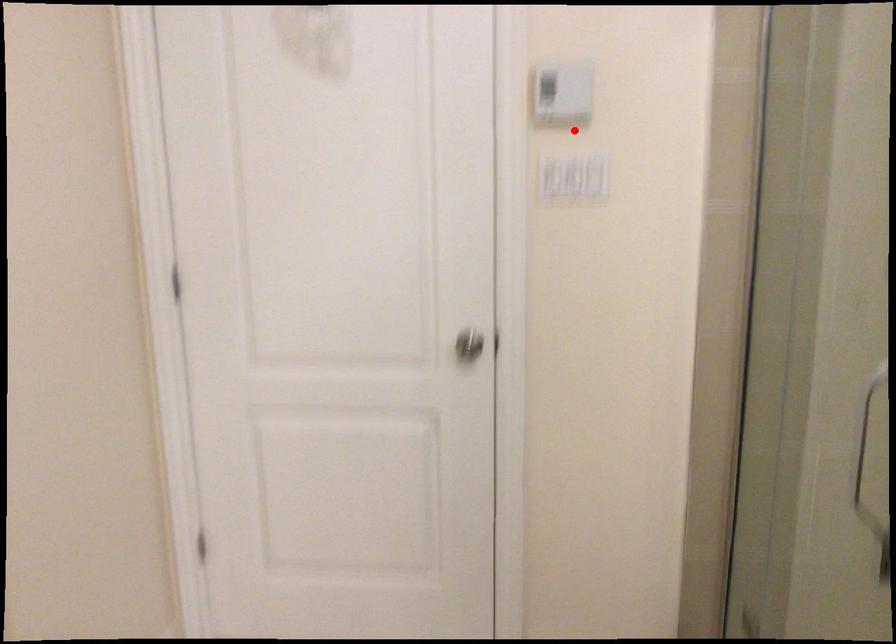
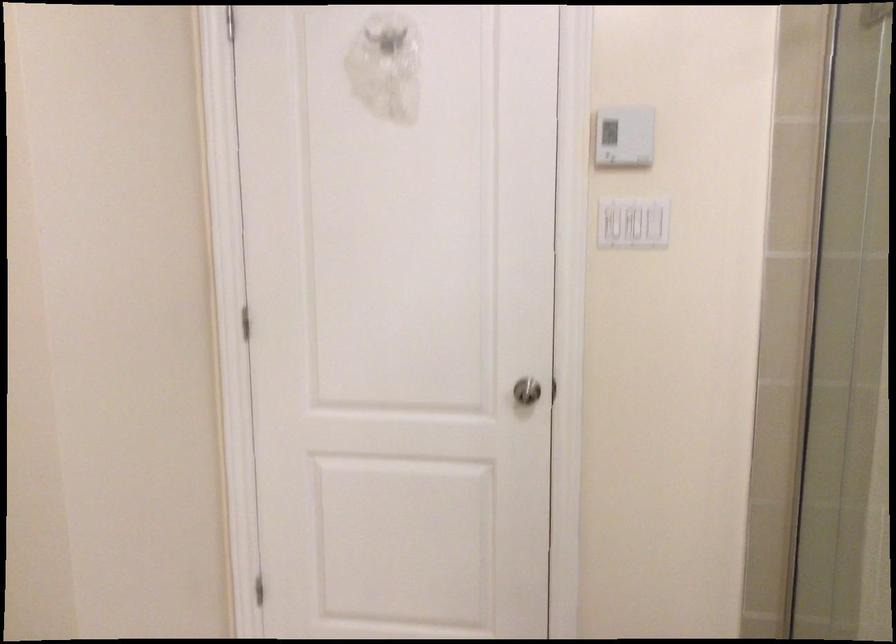
Where in the second image is the point corresponding to the highlighted location from the first image?

(633, 223)